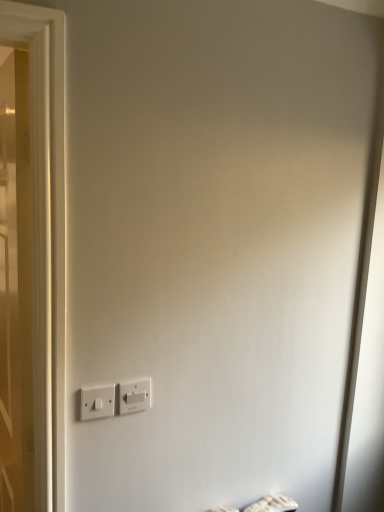
What do you see at coordinates (97, 402) in the screenshot? I see `white plastic power plugs and sockets at lower left, which is the first power plugs and sockets from left to right` at bounding box center [97, 402].

Identify the location of white plastic power plugs and sockets at lower center, the 2th power plugs and sockets when ordered from left to right. (135, 395).

Could you tell me if white wooden door at left is turned towards white plastic power plugs and sockets at lower left, which is counted as the second power plugs and sockets, starting from the right?

No, white wooden door at left is not turned towards white plastic power plugs and sockets at lower left, which is counted as the second power plugs and sockets, starting from the right.

From the image's perspective, is white wooden door at left under white plastic power plugs and sockets at lower left, which is counted as the second power plugs and sockets, starting from the right?

No.

Which of these two, white wooden door at left or white plastic power plugs and sockets at lower left, which is the first power plugs and sockets from left to right, stands shorter?

Standing shorter between the two is white plastic power plugs and sockets at lower left, which is the first power plugs and sockets from left to right.

From a real-world perspective, is white wooden door at left positioned under white plastic power plugs and sockets at lower left, which is the first power plugs and sockets from left to right, based on gravity?

Yes, from a real-world perspective, white wooden door at left is beneath white plastic power plugs and sockets at lower left, which is the first power plugs and sockets from left to right.

Between white plastic power plugs and sockets at lower left, which is counted as the second power plugs and sockets, starting from the right, and white plastic power plugs and sockets at lower center, the 2th power plugs and sockets when ordered from left to right, which one has larger size?

white plastic power plugs and sockets at lower left, which is counted as the second power plugs and sockets, starting from the right, is bigger.

Does white plastic power plugs and sockets at lower left, which is counted as the second power plugs and sockets, starting from the right, have a lesser width compared to white plastic power plugs and sockets at lower center, arranged as the 1th power plugs and sockets when viewed from the right?

Correct, the width of white plastic power plugs and sockets at lower left, which is counted as the second power plugs and sockets, starting from the right, is less than that of white plastic power plugs and sockets at lower center, arranged as the 1th power plugs and sockets when viewed from the right.

Which object is more forward, white plastic power plugs and sockets at lower left, which is counted as the second power plugs and sockets, starting from the right, or white plastic power plugs and sockets at lower center, the 2th power plugs and sockets when ordered from left to right?

white plastic power plugs and sockets at lower left, which is counted as the second power plugs and sockets, starting from the right.

Is white plastic power plugs and sockets at lower left, which is counted as the second power plugs and sockets, starting from the right, taller or shorter than white plastic power plugs and sockets at lower center, arranged as the 1th power plugs and sockets when viewed from the right?

Clearly, white plastic power plugs and sockets at lower left, which is counted as the second power plugs and sockets, starting from the right, is shorter compared to white plastic power plugs and sockets at lower center, arranged as the 1th power plugs and sockets when viewed from the right.

From the image's perspective, relative to white plastic power plugs and sockets at lower center, the 2th power plugs and sockets when ordered from left to right, is white wooden door at left above or below?

Based on their image positions, white wooden door at left is located above white plastic power plugs and sockets at lower center, the 2th power plugs and sockets when ordered from left to right.

Does point (6, 458) come farther from viewer compared to point (151, 389)?

That is True.

Which is more to the left, white wooden door at left or white plastic power plugs and sockets at lower center, the 2th power plugs and sockets when ordered from left to right?

→ white wooden door at left.

From a real-world perspective, relative to white wooden door at left, is white plastic power plugs and sockets at lower left, which is the first power plugs and sockets from left to right, vertically above or below?

white plastic power plugs and sockets at lower left, which is the first power plugs and sockets from left to right, is situated higher than white wooden door at left in the real world.

Can you tell me how much white plastic power plugs and sockets at lower left, which is the first power plugs and sockets from left to right, and white wooden door at left differ in facing direction?

The facing directions of white plastic power plugs and sockets at lower left, which is the first power plugs and sockets from left to right, and white wooden door at left are 80.3 degrees apart.

Can you confirm if white plastic power plugs and sockets at lower left, which is counted as the second power plugs and sockets, starting from the right, is smaller than white wooden door at left?

Yes, white plastic power plugs and sockets at lower left, which is counted as the second power plugs and sockets, starting from the right, is smaller than white wooden door at left.

From their relative heights in the image, would you say white plastic power plugs and sockets at lower left, which is the first power plugs and sockets from left to right, is taller or shorter than white wooden door at left?

In the image, white plastic power plugs and sockets at lower left, which is the first power plugs and sockets from left to right, appears to be shorter than white wooden door at left.

This screenshot has height=512, width=384. Find the location of `door that is on the left side of white plastic power plugs and sockets at lower center, the 2th power plugs and sockets when ordered from left to right`. door that is on the left side of white plastic power plugs and sockets at lower center, the 2th power plugs and sockets when ordered from left to right is located at coordinates (15, 287).

Is white plastic power plugs and sockets at lower center, the 2th power plugs and sockets when ordered from left to right, turned away from white wooden door at left?

white plastic power plugs and sockets at lower center, the 2th power plugs and sockets when ordered from left to right, does not have its back to white wooden door at left.

Looking at this image, can you tell me how much white plastic power plugs and sockets at lower center, the 2th power plugs and sockets when ordered from left to right, and white wooden door at left differ in facing direction?

The angular difference between white plastic power plugs and sockets at lower center, the 2th power plugs and sockets when ordered from left to right, and white wooden door at left is 79.5 degrees.

Based on the photo, is white plastic power plugs and sockets at lower center, arranged as the 1th power plugs and sockets when viewed from the right, oriented towards white plastic power plugs and sockets at lower left, which is the first power plugs and sockets from left to right?

No, white plastic power plugs and sockets at lower center, arranged as the 1th power plugs and sockets when viewed from the right, is not turned towards white plastic power plugs and sockets at lower left, which is the first power plugs and sockets from left to right.

Does white plastic power plugs and sockets at lower center, arranged as the 1th power plugs and sockets when viewed from the right, have a greater width compared to white plastic power plugs and sockets at lower left, which is the first power plugs and sockets from left to right?

Correct, the width of white plastic power plugs and sockets at lower center, arranged as the 1th power plugs and sockets when viewed from the right, exceeds that of white plastic power plugs and sockets at lower left, which is the first power plugs and sockets from left to right.

Considering the relative sizes of white plastic power plugs and sockets at lower center, arranged as the 1th power plugs and sockets when viewed from the right, and white plastic power plugs and sockets at lower left, which is counted as the second power plugs and sockets, starting from the right, in the image provided, is white plastic power plugs and sockets at lower center, arranged as the 1th power plugs and sockets when viewed from the right, shorter than white plastic power plugs and sockets at lower left, which is counted as the second power plugs and sockets, starting from the right,?

Incorrect, the height of white plastic power plugs and sockets at lower center, arranged as the 1th power plugs and sockets when viewed from the right, does not fall short of that of white plastic power plugs and sockets at lower left, which is counted as the second power plugs and sockets, starting from the right.

Is there a large distance between white plastic power plugs and sockets at lower center, arranged as the 1th power plugs and sockets when viewed from the right, and white plastic power plugs and sockets at lower left, which is counted as the second power plugs and sockets, starting from the right?

That's not correct — white plastic power plugs and sockets at lower center, arranged as the 1th power plugs and sockets when viewed from the right, is a little close to white plastic power plugs and sockets at lower left, which is counted as the second power plugs and sockets, starting from the right.

At what (x,y) coordinates should I click in order to perform the action: click on power plugs and sockets that is the 2nd object above the white wooden door at left (from a real-world perspective). Please return your answer as a coordinate pair (x, y). The height and width of the screenshot is (512, 384). Looking at the image, I should click on (97, 402).

Find the location of `power plugs and sockets in front of the white plastic power plugs and sockets at lower center, arranged as the 1th power plugs and sockets when viewed from the right`. power plugs and sockets in front of the white plastic power plugs and sockets at lower center, arranged as the 1th power plugs and sockets when viewed from the right is located at coordinates (97, 402).

Based on the photo, estimate the real-world distances between objects in this image. Which object is closer to white plastic power plugs and sockets at lower center, arranged as the 1th power plugs and sockets when viewed from the right, white wooden door at left or white plastic power plugs and sockets at lower left, which is counted as the second power plugs and sockets, starting from the right?

Based on the image, white plastic power plugs and sockets at lower left, which is counted as the second power plugs and sockets, starting from the right, appears to be nearer to white plastic power plugs and sockets at lower center, arranged as the 1th power plugs and sockets when viewed from the right.

Estimate the real-world distances between objects in this image. Which object is further from white wooden door at left, white plastic power plugs and sockets at lower left, which is counted as the second power plugs and sockets, starting from the right, or white plastic power plugs and sockets at lower center, the 2th power plugs and sockets when ordered from left to right?

white plastic power plugs and sockets at lower center, the 2th power plugs and sockets when ordered from left to right.

Looking at the image, which one is located further to white plastic power plugs and sockets at lower left, which is the first power plugs and sockets from left to right, white wooden door at left or white plastic power plugs and sockets at lower center, the 2th power plugs and sockets when ordered from left to right?

The object further to white plastic power plugs and sockets at lower left, which is the first power plugs and sockets from left to right, is white wooden door at left.

Considering their positions, is white plastic power plugs and sockets at lower left, which is counted as the second power plugs and sockets, starting from the right, positioned closer to white plastic power plugs and sockets at lower center, arranged as the 1th power plugs and sockets when viewed from the right, than white wooden door at left?

Among the two, white plastic power plugs and sockets at lower left, which is counted as the second power plugs and sockets, starting from the right, is located nearer to white plastic power plugs and sockets at lower center, arranged as the 1th power plugs and sockets when viewed from the right.

Which object lies further to the anchor point white wooden door at left, white plastic power plugs and sockets at lower center, the 2th power plugs and sockets when ordered from left to right, or white plastic power plugs and sockets at lower left, which is the first power plugs and sockets from left to right?

The object further to white wooden door at left is white plastic power plugs and sockets at lower center, the 2th power plugs and sockets when ordered from left to right.

From the image, which object appears to be nearer to white plastic power plugs and sockets at lower left, which is the first power plugs and sockets from left to right, white plastic power plugs and sockets at lower center, the 2th power plugs and sockets when ordered from left to right, or white wooden door at left?

The object closer to white plastic power plugs and sockets at lower left, which is the first power plugs and sockets from left to right, is white plastic power plugs and sockets at lower center, the 2th power plugs and sockets when ordered from left to right.

The height and width of the screenshot is (512, 384). What are the coordinates of `power plugs and sockets between white wooden door at left and white plastic power plugs and sockets at lower center, arranged as the 1th power plugs and sockets when viewed from the right` in the screenshot? It's located at (97, 402).